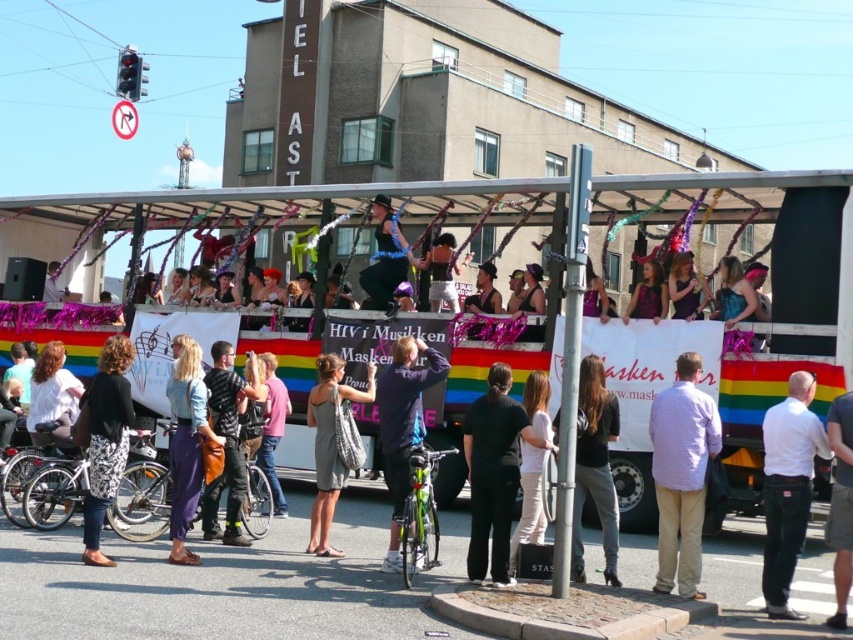
Does black matte pants at center have a lesser height compared to matte purple pants at lower left?

Correct, black matte pants at center is not as tall as matte purple pants at lower left.

How distant is black matte pants at center from matte purple pants at lower left?

black matte pants at center and matte purple pants at lower left are 3.44 meters apart.

Measure the distance between point (509, 518) and camera.

Point (509, 518) is 13.05 meters away from camera.

At what (x,y) coordinates should I click in order to perform the action: click on black matte pants at center. Please return your answer as a coordinate pair (x, y). This screenshot has height=640, width=853. Looking at the image, I should click on (492, 472).

Can you confirm if white glossy float at center is smaller than matte purple pants at lower left?

No.

Find the location of a particular element. white glossy float at center is located at coordinates (772, 282).

Who is more distant from viewer, (70, 236) or (189, 403)?

The point (70, 236) is more distant.

Where is `white glossy float at center`? white glossy float at center is located at coordinates (772, 282).

Based on the photo, who is positioned more to the left, light purple checkered shirt at center or matte purple pants at lower left?

From the viewer's perspective, matte purple pants at lower left appears more on the left side.

Between point (670, 588) and point (177, 364), which one is positioned behind?

The point (177, 364) is behind.

Find the location of `light purple checkered shirt at center`. light purple checkered shirt at center is located at coordinates (682, 474).